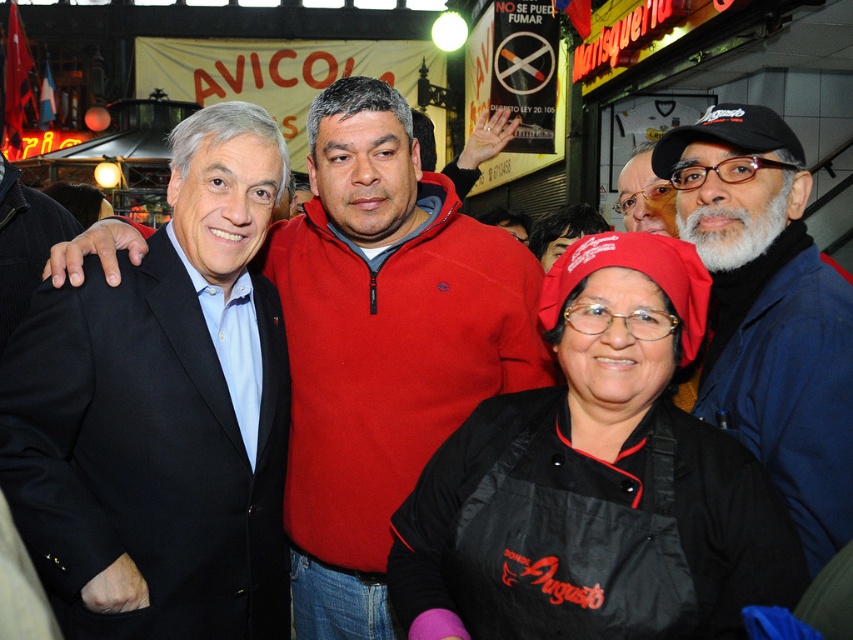
You are a photographer trying to capture a group photo of the people in the market scene. You notice the blue cotton jacket at center and the matte black hat at upper right. Which object should you focus on first if you want to ensure both are in the frame without moving the camera?

The blue cotton jacket at center is located below the matte black hat at upper right. To include both in the frame, focus on the matte black hat at upper right first since it is higher up, then ensure the blue cotton jacket at center is visible below it.

What color is the sweater worn by the person located at the coordinates point (383,344)?

The sweater at point (383,344) is smooth red.

You are standing at the point with coordinates point (294, 561) and want to move to the point with coordinates point (627, 240). Is the point you want to go to in front of you or behind you?

The point (627, 240) is in front of point (294, 561), so the point you want to go to is in front of you.